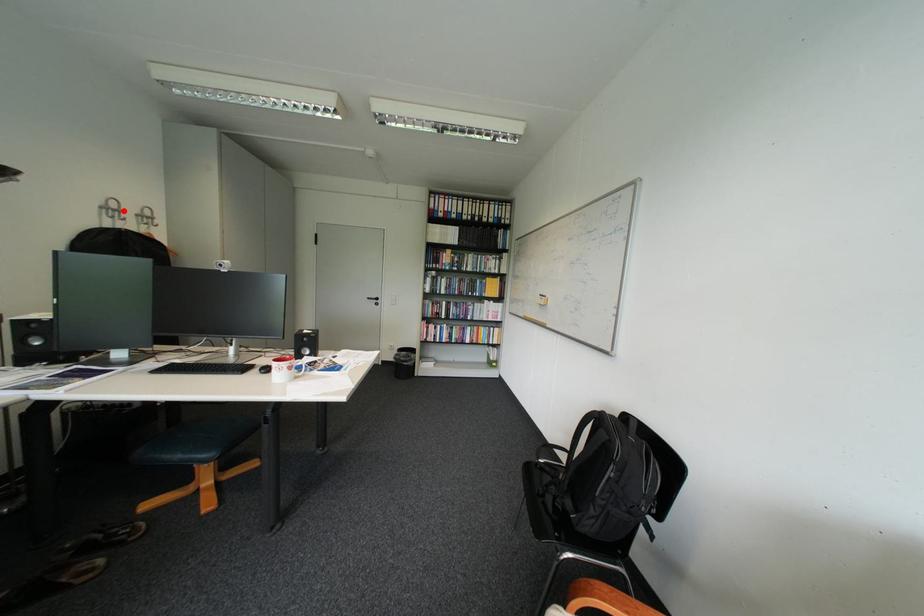
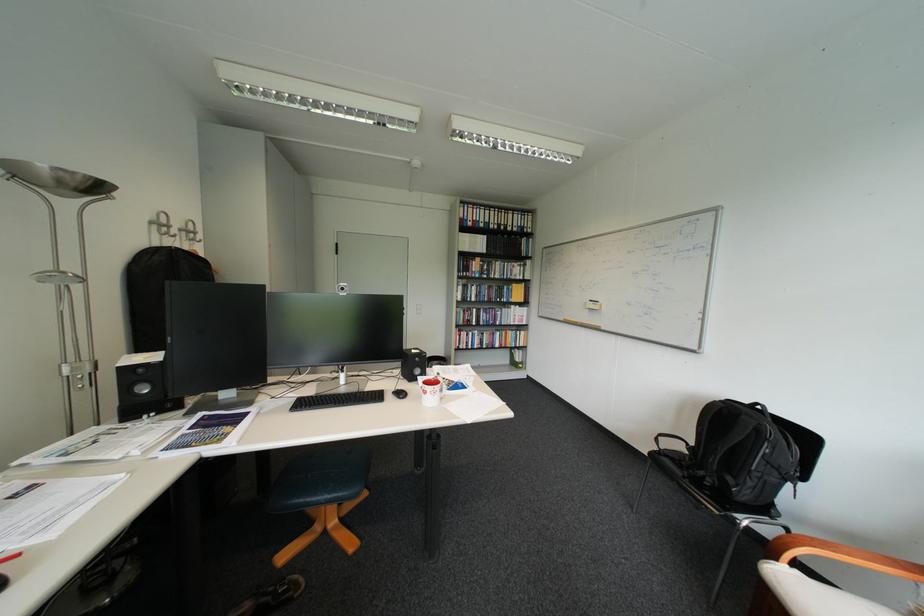
Find the pixel in the second image that matches the highlighted location in the first image.

(173, 225)